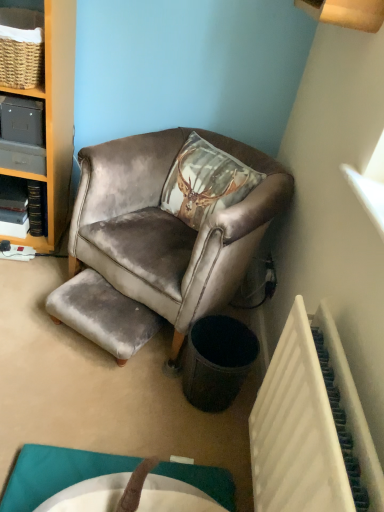
The width and height of the screenshot is (384, 512). I want to click on free location above velvet grey stool at lower left (from a real-world perspective), so click(103, 292).